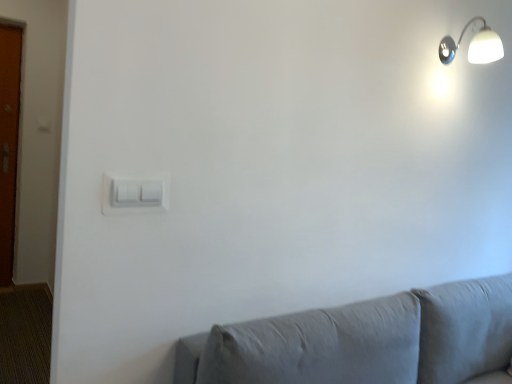
Question: Is white glossy wall lamp at upper right wider or thinner than white plastic light switch at center?

Choices:
 (A) wide
 (B) thin

Answer: (A)

Question: From the image's perspective, is white glossy wall lamp at upper right above or below white plastic light switch at center?

Choices:
 (A) above
 (B) below

Answer: (A)

Question: Is white glossy wall lamp at upper right taller or shorter than white plastic light switch at center?

Choices:
 (A) tall
 (B) short

Answer: (A)

Question: Based on their sizes in the image, would you say white plastic light switch at center is bigger or smaller than white glossy wall lamp at upper right?

Choices:
 (A) big
 (B) small

Answer: (B)

Question: Is white plastic light switch at center wider or thinner than white glossy wall lamp at upper right?

Choices:
 (A) wide
 (B) thin

Answer: (B)

Question: Is white plastic light switch at center taller or shorter than white glossy wall lamp at upper right?

Choices:
 (A) tall
 (B) short

Answer: (B)

Question: Is point (163, 201) positioned closer to the camera than point (476, 46)?

Choices:
 (A) farther
 (B) closer

Answer: (B)